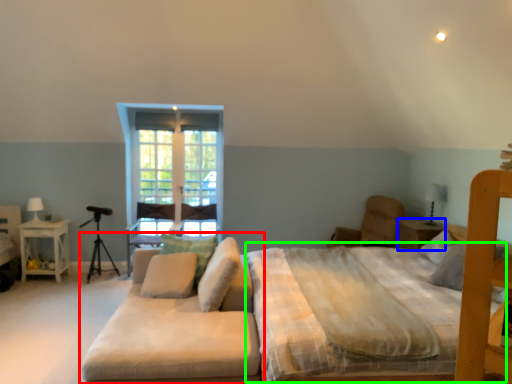
Question: Based on their relative distances, which object is farther from studio couch (highlighted by a red box)? Choose from nightstand (highlighted by a blue box) and mattress (highlighted by a green box).

Choices:
 (A) nightstand
 (B) mattress

Answer: (A)